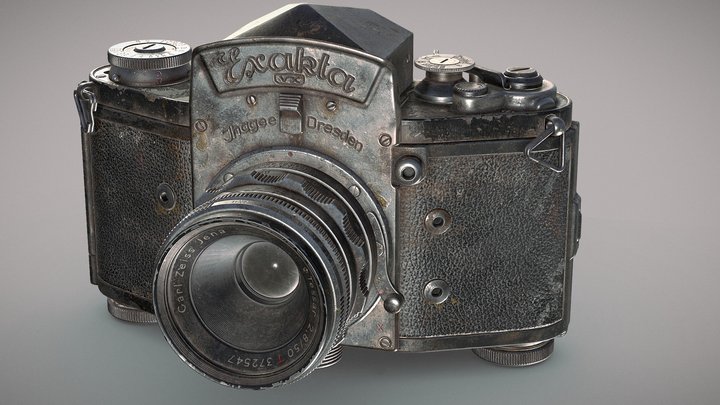
This screenshot has height=405, width=720. I want to click on screws, so click(412, 172), click(441, 221), click(441, 295), click(397, 300), click(166, 197).